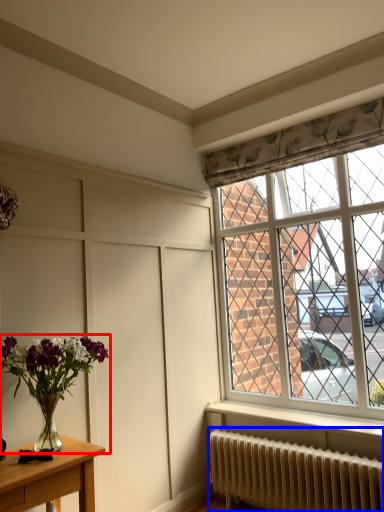
Question: Among these objects, which one is farthest to the camera, houseplant (highlighted by a red box) or radiator (highlighted by a blue box)?

Choices:
 (A) houseplant
 (B) radiator

Answer: (B)